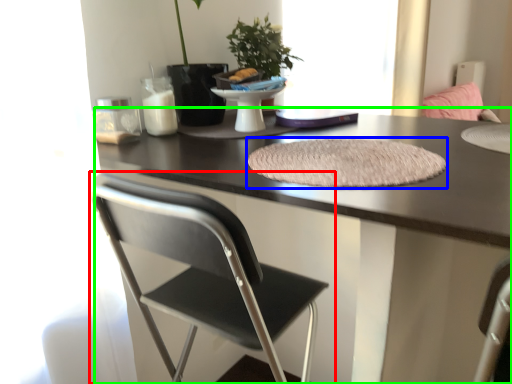
Question: Which object is the farthest from chair (highlighted by a red box)? Choose among these: mat (highlighted by a blue box) or desk (highlighted by a green box).

Choices:
 (A) mat
 (B) desk

Answer: (A)